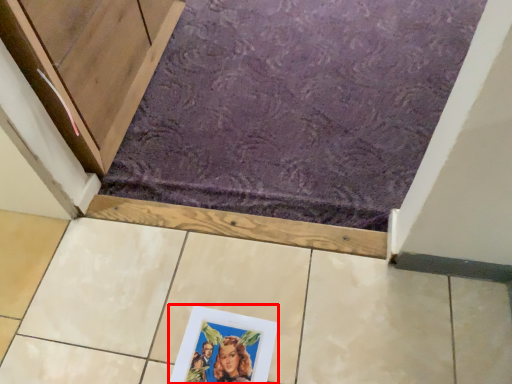
Question: From the image, what is the correct spatial relationship of picture frame (annotated by the red box) in relation to bath mat?

Choices:
 (A) left
 (B) right

Answer: (A)